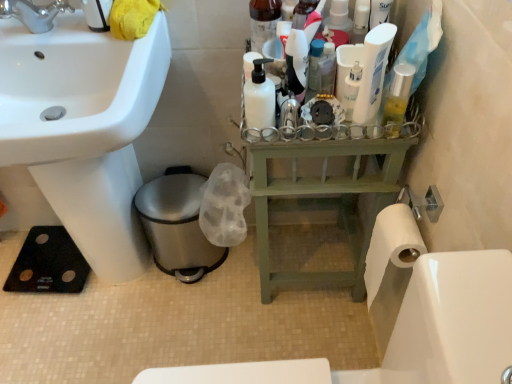
Question: Is white glossy sink at lower left closer to the viewer compared to black rubber mat at lower left?

Choices:
 (A) yes
 (B) no

Answer: (B)

Question: From a real-world perspective, is white glossy sink at lower left over black rubber mat at lower left?

Choices:
 (A) no
 (B) yes

Answer: (A)

Question: Is white glossy sink at lower left to the left of black rubber mat at lower left from the viewer's perspective?

Choices:
 (A) yes
 (B) no

Answer: (A)

Question: From the image's perspective, is white glossy sink at lower left below black rubber mat at lower left?

Choices:
 (A) yes
 (B) no

Answer: (B)

Question: Is there a large distance between white glossy sink at lower left and black rubber mat at lower left?

Choices:
 (A) no
 (B) yes

Answer: (A)

Question: Considering the relative sizes of white glossy sink at lower left and black rubber mat at lower left in the image provided, is white glossy sink at lower left wider than black rubber mat at lower left?

Choices:
 (A) no
 (B) yes

Answer: (A)

Question: Is black rubber mat at lower left taller than white glossy lotion at center, marked as the 1th toiletry in a right-to-left arrangement?

Choices:
 (A) yes
 (B) no

Answer: (A)

Question: From the image's perspective, is black rubber mat at lower left below white glossy lotion at center, marked as the 1th toiletry in a right-to-left arrangement?

Choices:
 (A) yes
 (B) no

Answer: (A)

Question: Considering the relative sizes of black rubber mat at lower left and white glossy lotion at center, marked as the 1th toiletry in a right-to-left arrangement, in the image provided, is black rubber mat at lower left smaller than white glossy lotion at center, marked as the 1th toiletry in a right-to-left arrangement,?

Choices:
 (A) no
 (B) yes

Answer: (A)

Question: Is black rubber mat at lower left aimed at white glossy lotion at center, marked as the 1th toiletry in a right-to-left arrangement?

Choices:
 (A) yes
 (B) no

Answer: (B)

Question: Considering the relative positions of black rubber mat at lower left and white glossy lotion at center, which is the 3th toiletry in left-to-right order, in the image provided, is black rubber mat at lower left to the left of white glossy lotion at center, which is the 3th toiletry in left-to-right order, from the viewer's perspective?

Choices:
 (A) no
 (B) yes

Answer: (B)

Question: Can you confirm if black rubber mat at lower left is positioned to the right of white glossy lotion at center, which is the 3th toiletry in left-to-right order?

Choices:
 (A) yes
 (B) no

Answer: (B)

Question: Is black rubber mat at lower left located within matte black bottle at center, the second toiletry in the right-to-left sequence?

Choices:
 (A) no
 (B) yes

Answer: (A)